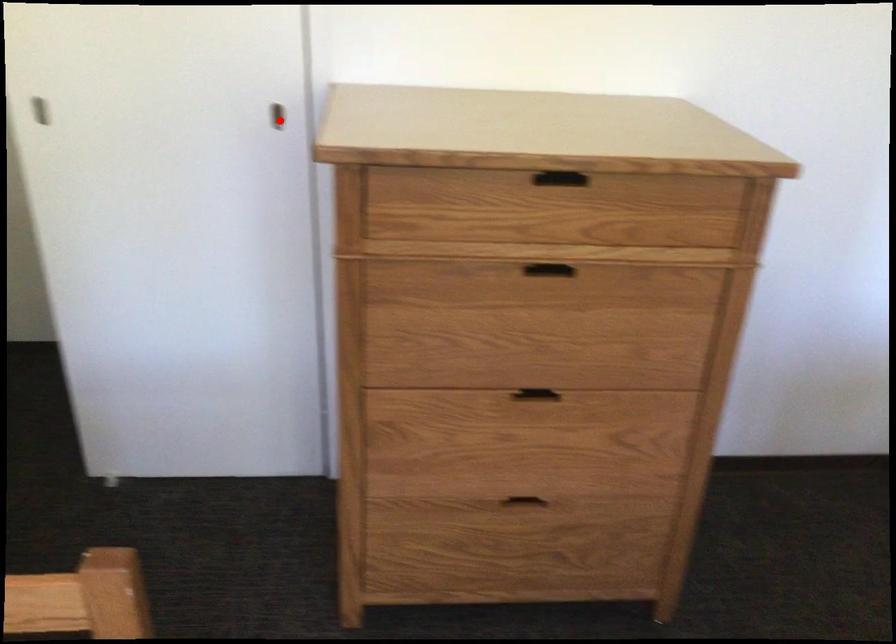
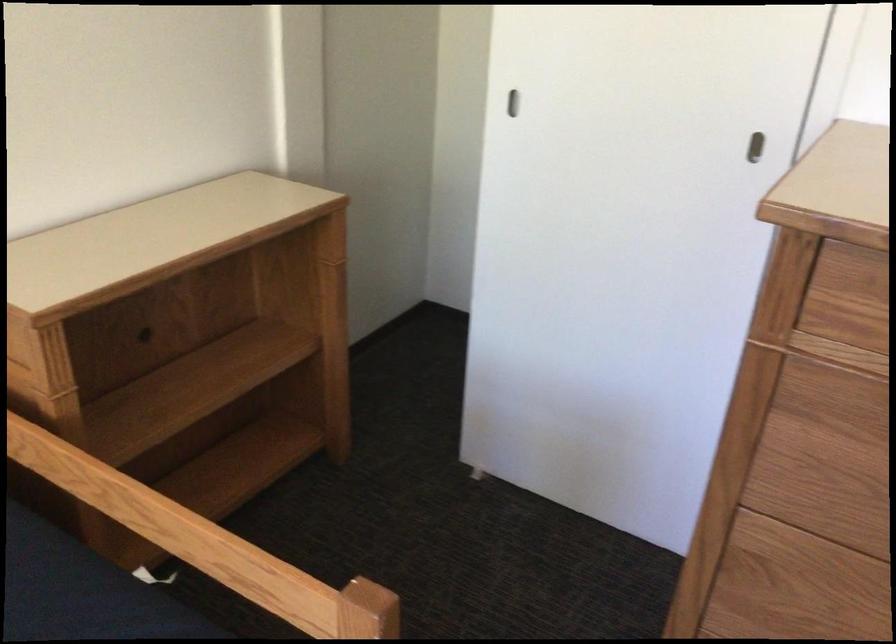
Find the pixel in the second image that matches the highlighted location in the first image.

(754, 147)